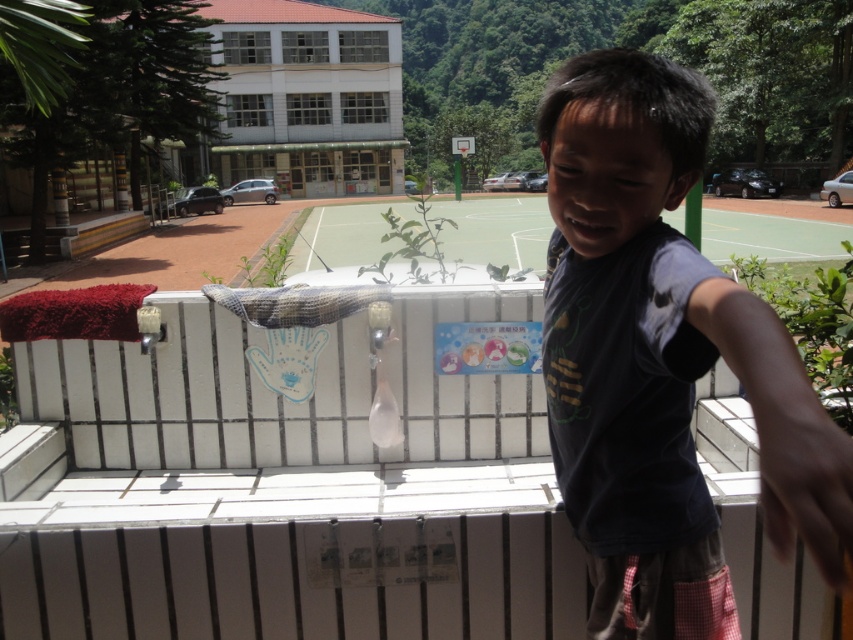
Does white tile balcony at center have a smaller size compared to dark gray t-shirt at center?

Actually, white tile balcony at center might be larger than dark gray t-shirt at center.

Can you confirm if white tile balcony at center is taller than dark gray t-shirt at center?

Yes, white tile balcony at center is taller than dark gray t-shirt at center.

The width and height of the screenshot is (853, 640). What are the coordinates of `white tile balcony at center` in the screenshot? It's located at (281, 486).